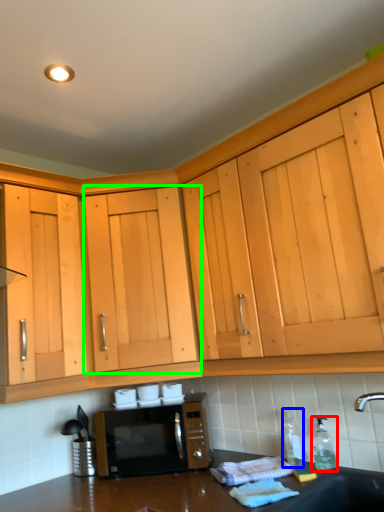
Question: Which object is the farthest from bottle (highlighted by a red box)? Choose among these: bottle (highlighted by a blue box) or cabinetry (highlighted by a green box).

Choices:
 (A) bottle
 (B) cabinetry

Answer: (B)